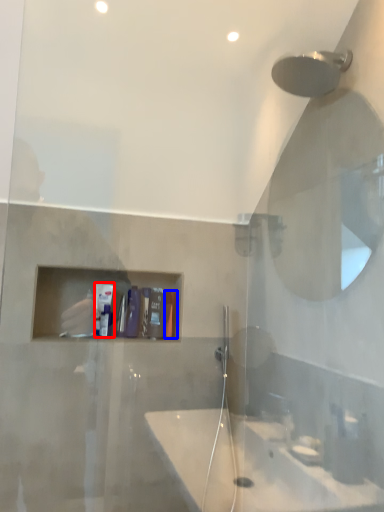
Question: Which object is closer to the camera taking this photo, toiletry (highlighted by a red box) or toiletry (highlighted by a blue box)?

Choices:
 (A) toiletry
 (B) toiletry

Answer: (A)